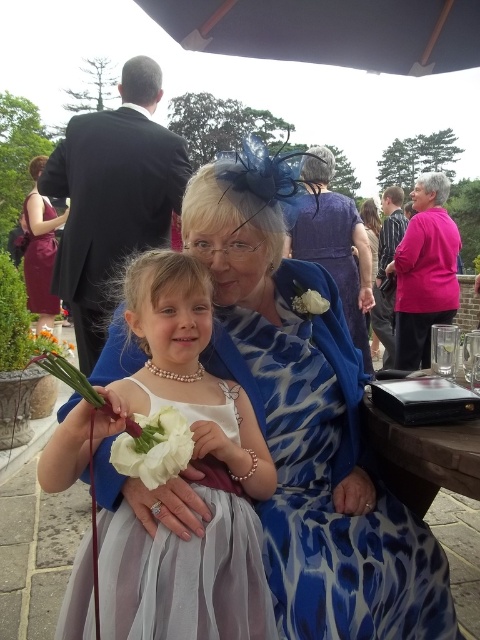
What do you see at coordinates (154, 445) in the screenshot?
I see `white silk flower at center` at bounding box center [154, 445].

Find the location of a particular element. white silk flower at center is located at coordinates (154, 445).

Locate an element on the screen. The width and height of the screenshot is (480, 640). white silk flower at center is located at coordinates 154,445.

Identify the location of white silk flower at center. (154, 445).

Which is in front, point (121, 508) or point (321, 307)?

Positioned in front is point (121, 508).

Is white satin dress at center behind white fabric flower at center?

No, white satin dress at center is closer to the viewer.

Is point (142, 634) behind point (313, 291)?

No, (142, 634) is in front of (313, 291).

I want to click on white satin dress at center, so click(191, 481).

Does point (444, 608) come behind point (325, 211)?

No, it is not.

Is point (311, 468) in front of point (331, 227)?

Yes, it is.

Image resolution: width=480 pixels, height=640 pixels. I want to click on blue textured dress at center, so click(x=308, y=420).